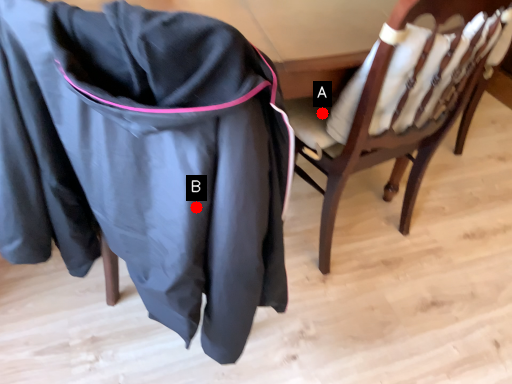
Question: Two points are circled on the image, labeled by A and B beside each circle. Which point appears closest to the camera in this image?

Choices:
 (A) A is closer
 (B) B is closer

Answer: (B)